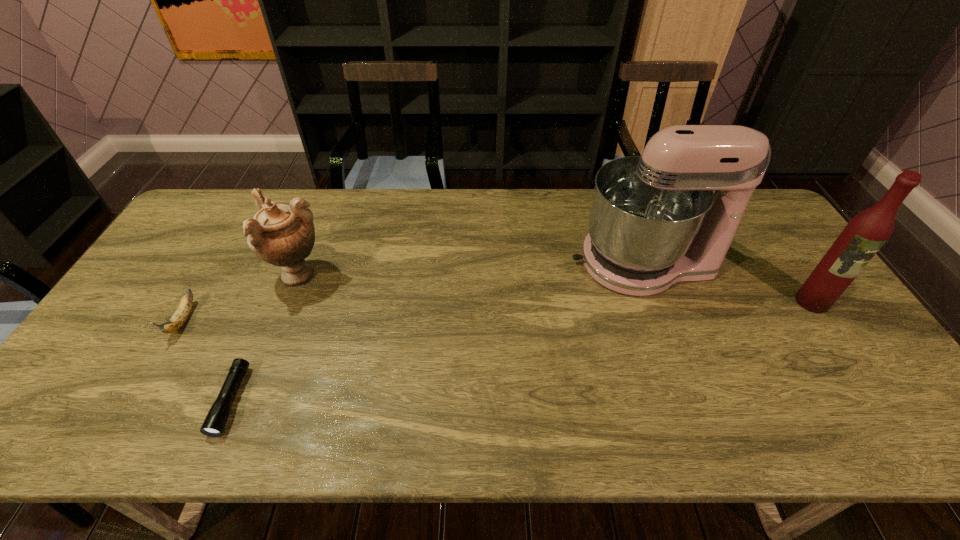
This screenshot has width=960, height=540. Find the location of `vacant region located on the label of the rightmost object`. vacant region located on the label of the rightmost object is located at coordinates (891, 417).

Find the location of a particular element. vacant space located on the front of the third shortest object is located at coordinates (270, 348).

This screenshot has height=540, width=960. In order to click on vacant point located 0.060m on the peel of the leftmost object in this screenshot , I will do `click(157, 363)`.

The width and height of the screenshot is (960, 540). Find the location of `object at the far edge`. object at the far edge is located at coordinates (656, 213).

This screenshot has width=960, height=540. Find the location of `object present at the near edge`. object present at the near edge is located at coordinates (216, 419).

The image size is (960, 540). I want to click on object present at the right edge, so click(864, 235).

This screenshot has height=540, width=960. I want to click on vacant region at the far edge of the desktop, so click(520, 205).

Where is `free spot at the near edge of the desktop`? The width and height of the screenshot is (960, 540). free spot at the near edge of the desktop is located at coordinates (447, 438).

Where is `free space at the left edge of the desktop`? The width and height of the screenshot is (960, 540). free space at the left edge of the desktop is located at coordinates (157, 313).

In the image, there is a desktop. Identify the location of vacant region at the right edge. Image resolution: width=960 pixels, height=540 pixels. (776, 246).